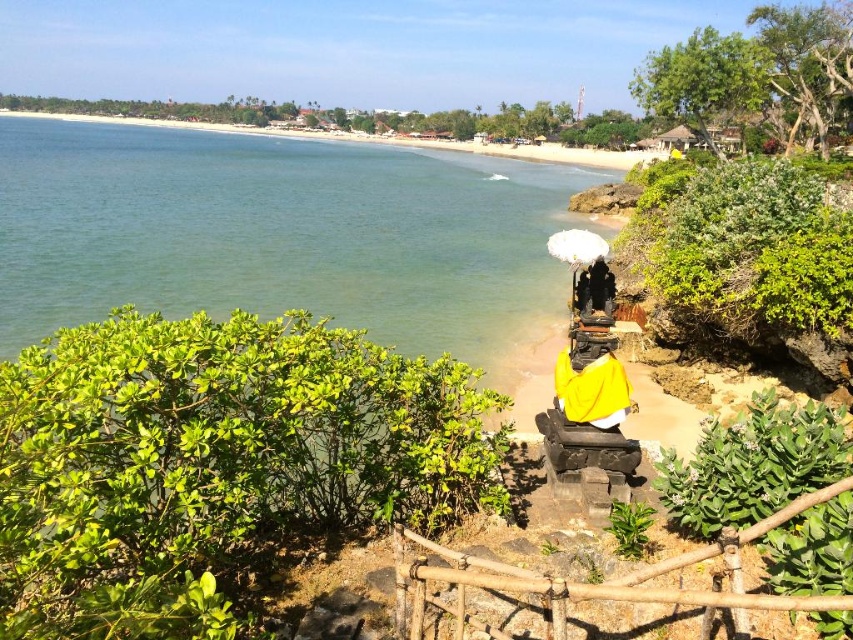
Is green water at lower left positioned before yellow draped statue at center?

That is False.

Can you confirm if green water at lower left is wider than yellow draped statue at center?

Correct, the width of green water at lower left exceeds that of yellow draped statue at center.

At what (x,y) coordinates should I click in order to perform the action: click on green water at lower left. Please return your answer as a coordinate pair (x, y). The image size is (853, 640). Looking at the image, I should click on click(280, 234).

Between green water at lower left and brown bamboo fence at center, which one is positioned higher?

green water at lower left

Does green water at lower left appear on the left side of brown bamboo fence at center?

Indeed, green water at lower left is positioned on the left side of brown bamboo fence at center.

Describe the element at coordinates (280, 234) in the screenshot. The image size is (853, 640). I see `green water at lower left` at that location.

Find the location of a particular element. green water at lower left is located at coordinates (280, 234).

Between point (550, 592) and point (593, 412), which one is positioned in front?

Positioned in front is point (550, 592).

Which is behind, point (480, 577) or point (576, 401)?

The point (576, 401) is more distant.

At what (x,y) coordinates should I click in order to perform the action: click on brown bamboo fence at center. Please return your answer as a coordinate pair (x, y). The image size is (853, 640). Looking at the image, I should click on (602, 582).